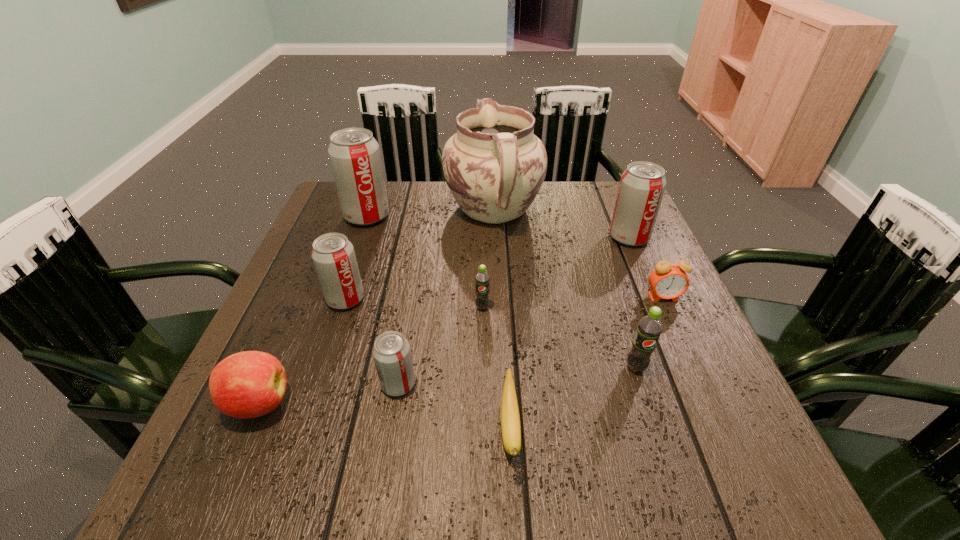
Locate an element on the screen. free space located 0.360m on the front label of the fourth soda can from left to right is located at coordinates (484, 481).

I want to click on free space located on the back of the nearest gray soda can, so click(411, 307).

In order to click on vacant space located 0.330m on the face of the alarm clock in this screenshot , I will do (x=730, y=444).

At what (x,y) coordinates should I click in order to perform the action: click on vacant space located 0.310m on the back of the apple. Please return your answer as a coordinate pair (x, y). Looking at the image, I should click on (316, 270).

The height and width of the screenshot is (540, 960). I want to click on pitcher that is at the far edge, so 494,166.

Find the location of a particular element. Image resolution: width=960 pixels, height=540 pixels. object situated at the near edge is located at coordinates (510, 420).

The height and width of the screenshot is (540, 960). Identify the location of apple present at the left edge. (249, 384).

Identify the location of alarm clock positioned at the right edge. (668, 280).

At what (x,y) coordinates should I click in order to perform the action: click on object present at the far left corner. Please return your answer as a coordinate pair (x, y). Looking at the image, I should click on (354, 154).

In order to click on object located in the far right corner section of the desktop in this screenshot , I will do `click(642, 185)`.